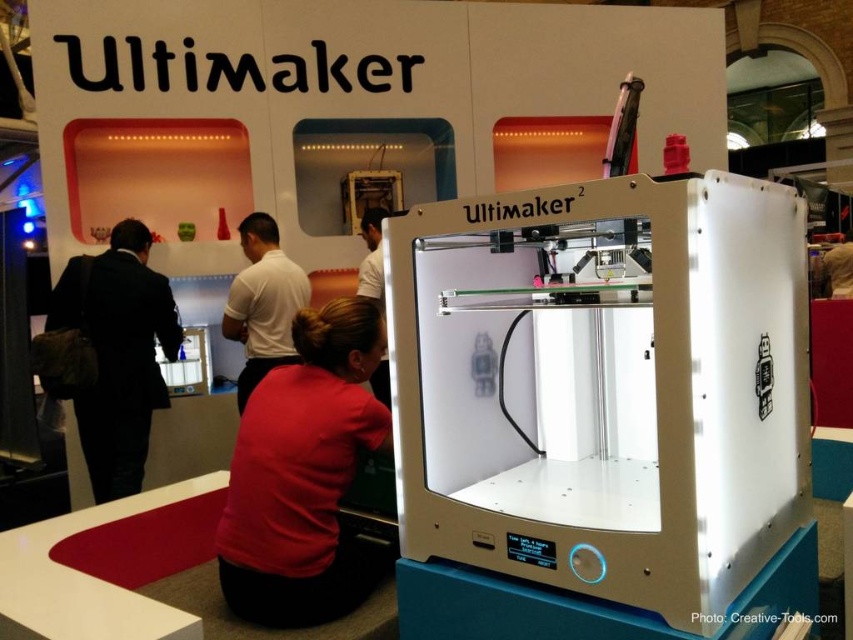
Question: Among these points, which one is nearest to the camera?

Choices:
 (A) (344, 563)
 (B) (380, 372)
 (C) (252, 353)
 (D) (49, 321)

Answer: (A)

Question: Is black suit at left bigger than matte white shirt at center?

Choices:
 (A) yes
 (B) no

Answer: (A)

Question: Considering the relative positions of red matte shirt at lower center and black suit at left in the image provided, where is red matte shirt at lower center located with respect to black suit at left?

Choices:
 (A) left
 (B) right

Answer: (B)

Question: Which point appears closest to the camera in this image?

Choices:
 (A) (311, 582)
 (B) (167, 307)
 (C) (381, 216)
 (D) (229, 339)

Answer: (A)

Question: Among these points, which one is farthest from the camera?

Choices:
 (A) (374, 216)
 (B) (277, 616)
 (C) (268, 353)
 (D) (152, 401)

Answer: (A)

Question: Is the position of black suit at left less distant than that of matte white shirt at center?

Choices:
 (A) yes
 (B) no

Answer: (A)